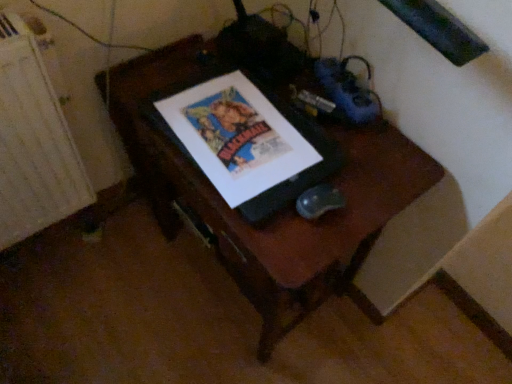
Find the location of a particular element. unoccupied region to the right of matte paper poster at center is located at coordinates (370, 166).